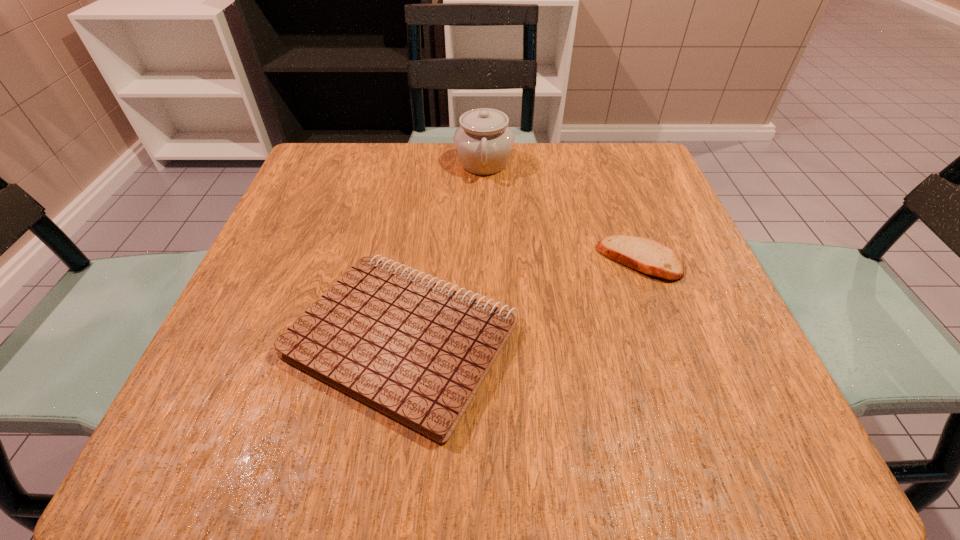
Locate an element on the screen. The image size is (960, 540). the closest object to the farthest object is located at coordinates (645, 255).

Where is `vacant area in the image that satisfies the following two spatial constraints: 1. on the back side of the tallest object; 2. on the left side of the notebook`? This screenshot has width=960, height=540. vacant area in the image that satisfies the following two spatial constraints: 1. on the back side of the tallest object; 2. on the left side of the notebook is located at coordinates (428, 163).